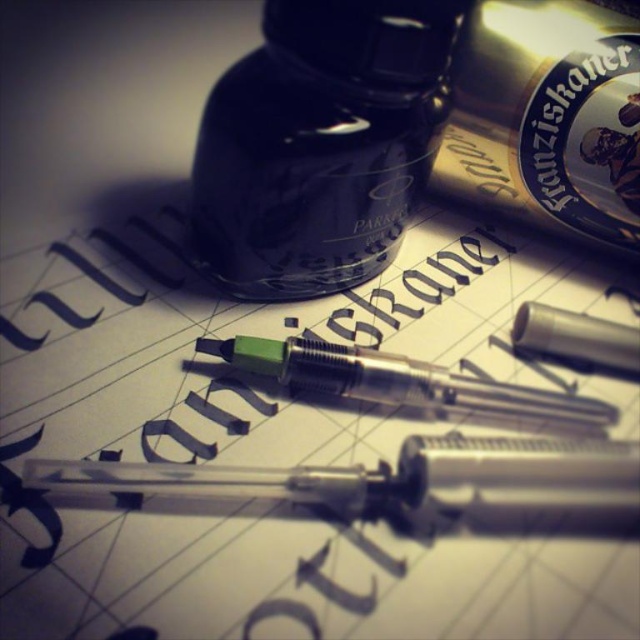
Is matte paper at center below transparent plastic pencil at center?

No, matte paper at center is not below transparent plastic pencil at center.

Between matte paper at center and transparent plastic pencil at center, which one is positioned lower?

Positioned lower is transparent plastic pencil at center.

Which is in front, point (396, 348) or point (552, 497)?

Point (552, 497) is more forward.

Locate an element on the screen. matte paper at center is located at coordinates (278, 445).

Is point (529, 113) in front of point (339, 384)?

No, it is not.

Does gold metallic bottle at upper right appear on the right side of green plastic pen at center?

Yes, gold metallic bottle at upper right is to the right of green plastic pen at center.

Identify the location of gold metallic bottle at upper right. This screenshot has width=640, height=640. (547, 118).

Between matte paper at center and green plastic pen at center, which one has less height?

green plastic pen at center

Does point (480, 324) come closer to viewer compared to point (371, 371)?

No, it is not.

Locate an element on the screen. The width and height of the screenshot is (640, 640). matte paper at center is located at coordinates tap(278, 445).